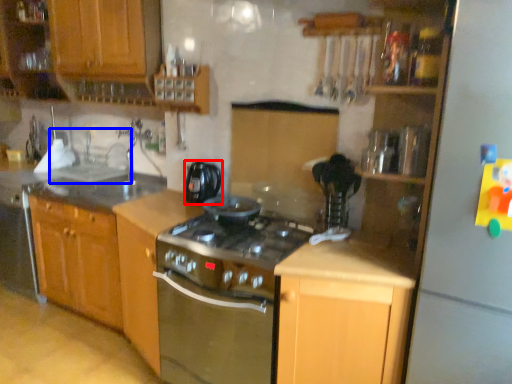
Question: Which object appears closest to the camera in this image, kitchen appliance (highlighted by a red box) or sink (highlighted by a blue box)?

Choices:
 (A) kitchen appliance
 (B) sink

Answer: (A)